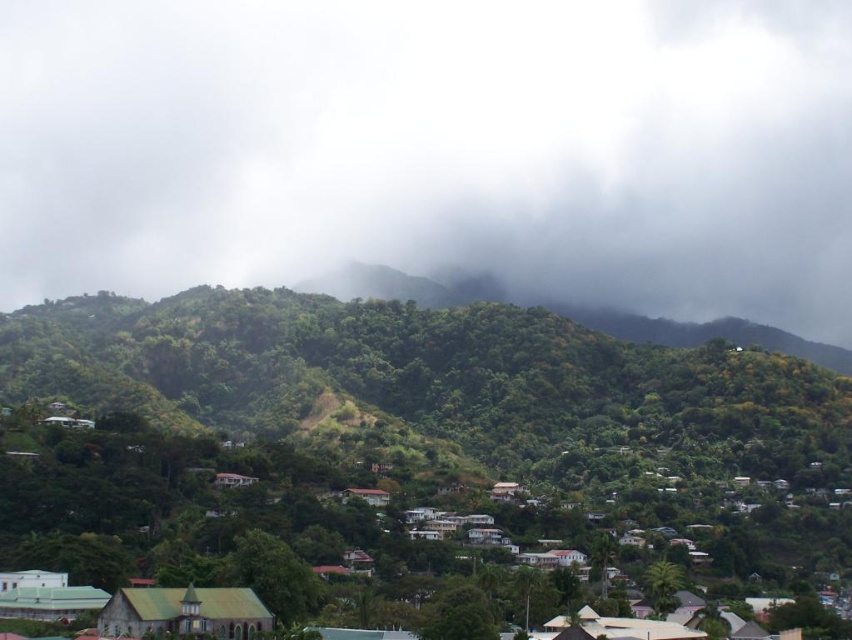
You are an architect designing a new building in this area. You need to ensure that the building will not block the view of the white fluffy cloud at upper center from the green corrugated metal roof at lower left. Based on their sizes, is this feasible?

The white fluffy cloud at upper center is wider than the green corrugated metal roof at lower left, so it is possible to design the building in a way that avoids blocking the view of the cloud from the roof since the cloud is larger and might be positioned higher in the sky.